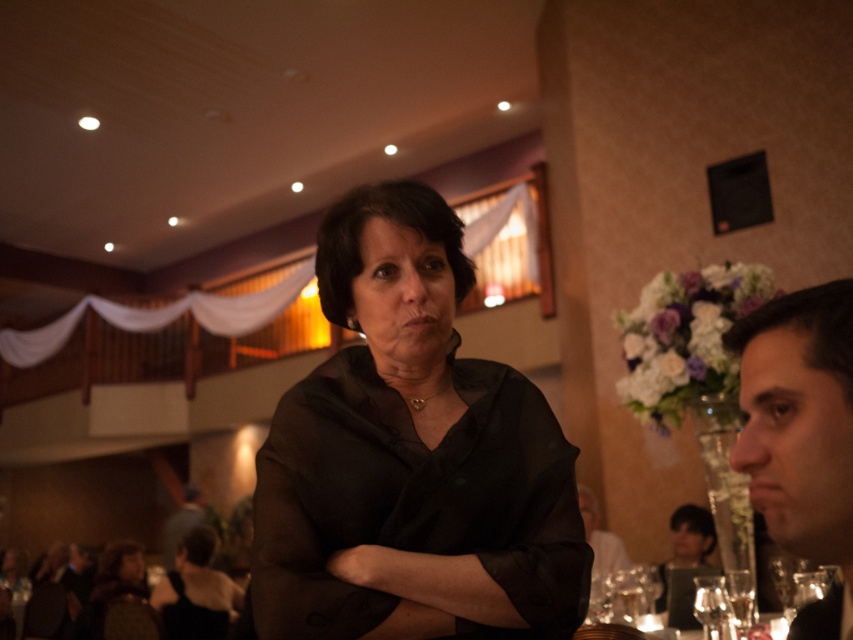
You are standing in the banquet hall and see two points marked in the image. The first point is at coordinates point (412, 586) and the second is at point (694, 518). Which point is closer to you?

Point (412, 586) is in front of point (694, 518), so it is closer to you.

You are standing in the banquet hall and want to place a decorative item exactly at the point marked as point (805, 292). The item requires a minimum of 30 inches of space from the camera to avoid obstruction. Is the current distance sufficient?

The distance of point (805, 292) from the camera is 27.85 inches, which is less than the required 30 inches. Therefore, placing the item there would result in obstruction.